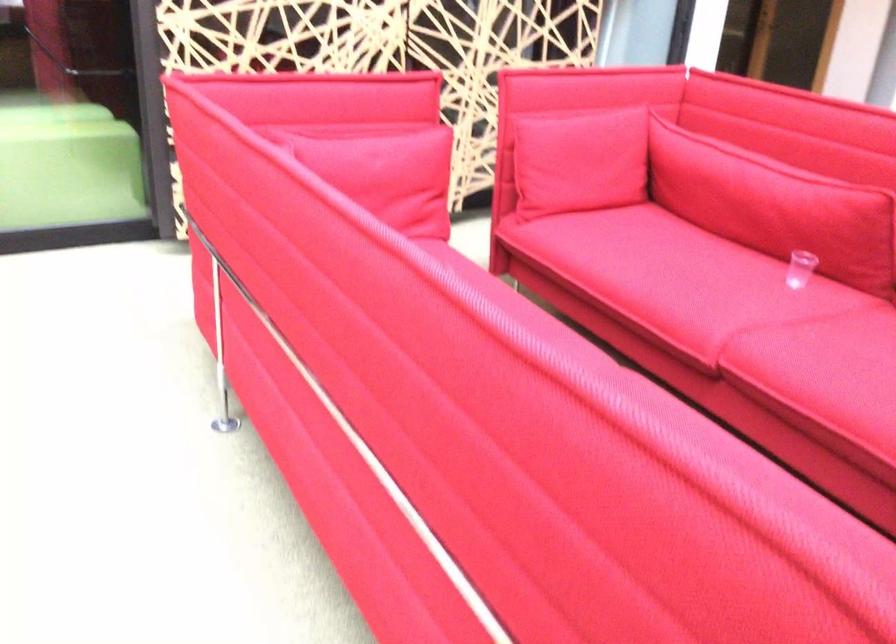
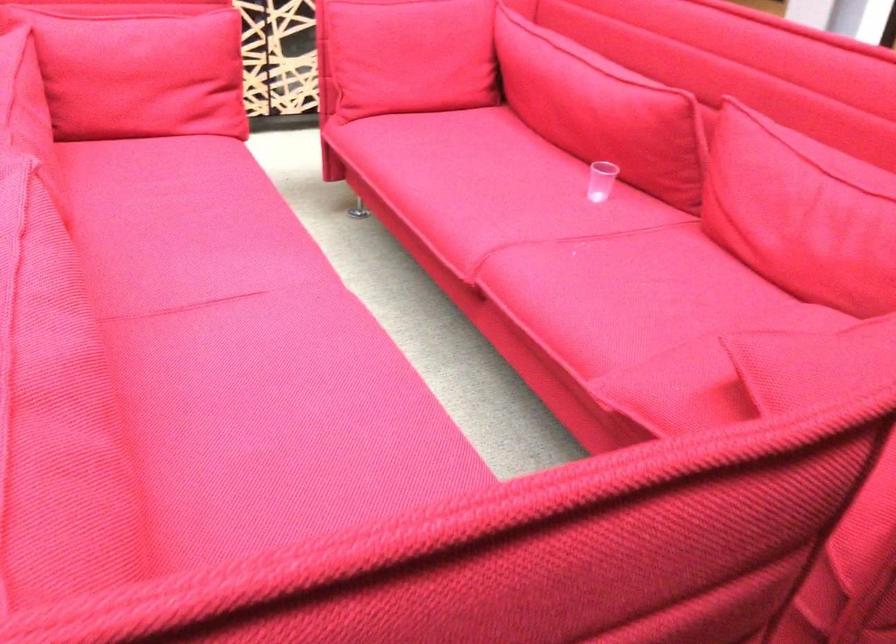
The point at (694, 278) is marked in the first image. Where is the corresponding point in the second image?

(488, 192)